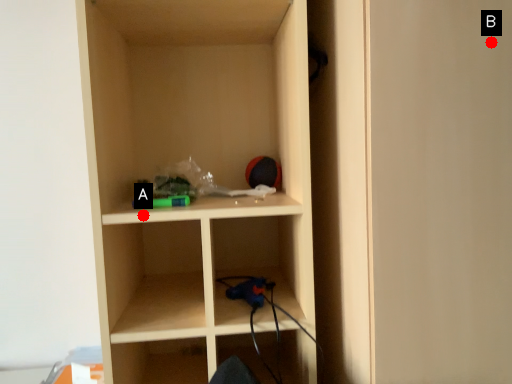
Question: Two points are circled on the image, labeled by A and B beside each circle. Which point is closer to the camera?

Choices:
 (A) A is closer
 (B) B is closer

Answer: (B)